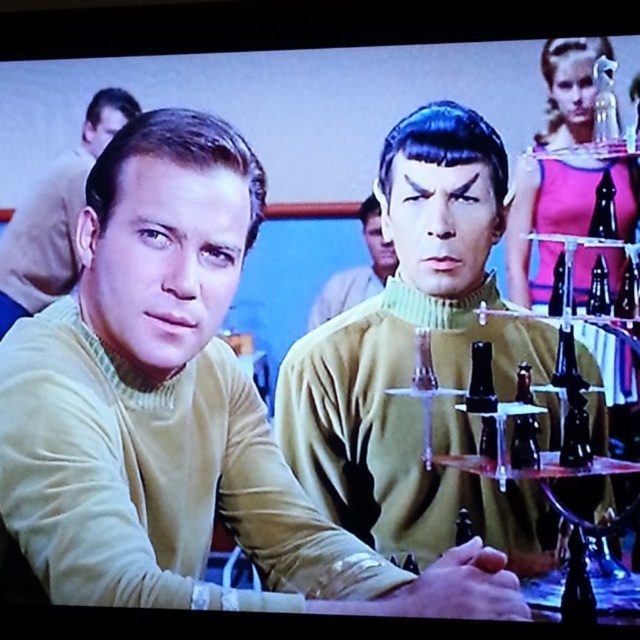
You are a character in the scene and need to move from point A to point B. Point A is at coordinate point [387,264] and point B is at coordinate point [573,410]. Which point is closer to you?

Point A at coordinate point [387,264] is closer to you than point B at coordinate point [573,410].

You are a costume designer reviewing this scene. You notice two matte yellow sweaters in the image. Where is the matte yellow sweater at center located relative to the matte yellow sweater at left?

The matte yellow sweater at center is to the right of the matte yellow sweater at left.

You are designing a costume for a sci fi show and need to choose between the matte yellow sweater at center and the matte yellow sweater at left. Which one is wider?

The matte yellow sweater at center is wider than the matte yellow sweater at left.